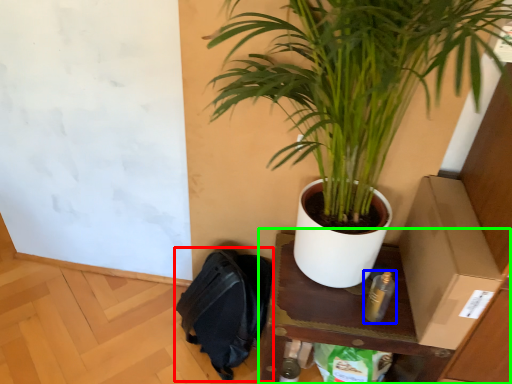
Question: Which object is positioned farthest from backpack (highlighted by a red box)? Select from bottle (highlighted by a blue box) and table (highlighted by a green box).

Choices:
 (A) bottle
 (B) table

Answer: (A)